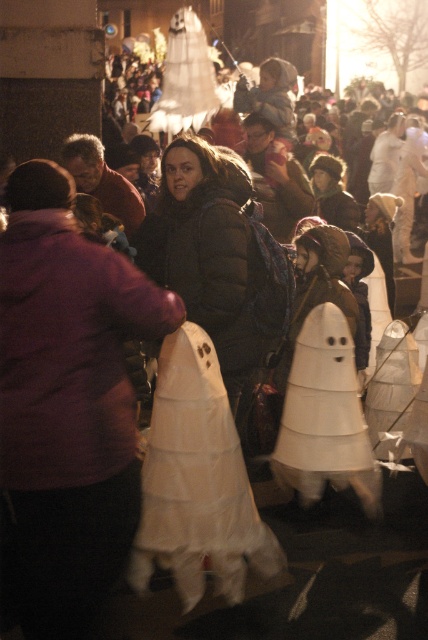
Question: Observing the image, what is the correct spatial positioning of white paper ghost at center in reference to white paper cone at center?

Choices:
 (A) above
 (B) below

Answer: (B)

Question: Which point appears farthest from the camera in this image?

Choices:
 (A) (168, 499)
 (B) (374, 508)

Answer: (B)

Question: Can you confirm if white paper ghost at center is positioned below white paper cone at center?

Choices:
 (A) yes
 (B) no

Answer: (A)

Question: Can you confirm if white paper ghost at center is positioned above white paper cone at center?

Choices:
 (A) no
 (B) yes

Answer: (A)